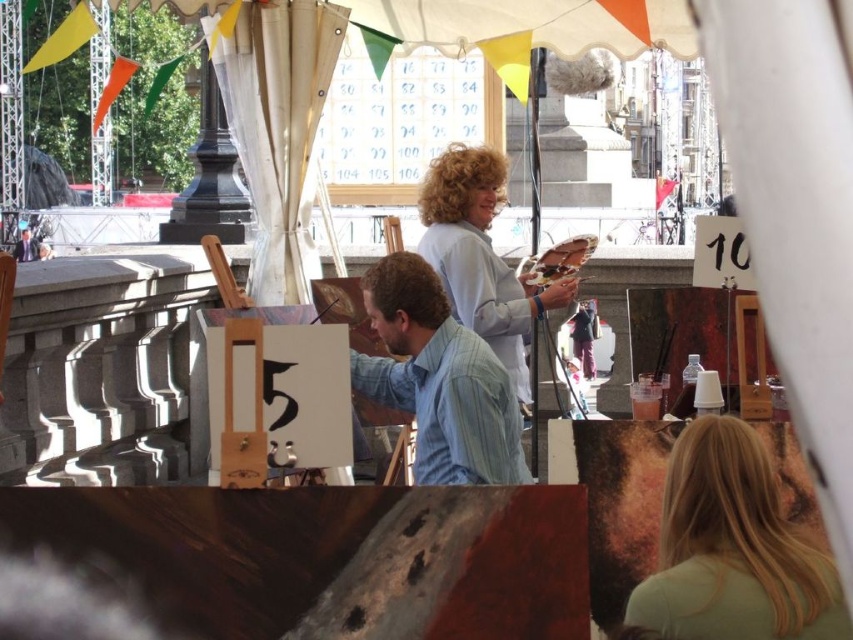
Which of these two, blonde hair at upper right or light blue fabric at center, stands taller?

With more height is light blue fabric at center.

At what (x,y) coordinates should I click in order to perform the action: click on blonde hair at upper right. Please return your answer as a coordinate pair (x, y). Looking at the image, I should click on (733, 548).

How far apart are blonde hair at upper right and light blue striped shirt at center?

blonde hair at upper right and light blue striped shirt at center are 13.16 meters apart from each other.

Who is more forward, [788,545] or [434,355]?

Positioned in front is point [788,545].

At what (x,y) coordinates should I click in order to perform the action: click on blonde hair at upper right. Please return your answer as a coordinate pair (x, y). The height and width of the screenshot is (640, 853). Looking at the image, I should click on (733, 548).

Which of these two, light blue striped shirt at center or light blue fabric at center, stands shorter?

With less height is light blue striped shirt at center.

Is light blue striped shirt at center positioned at the back of light blue fabric at center?

No, it is not.

Find the location of a particular element. light blue striped shirt at center is located at coordinates (438, 380).

Where is `light blue striped shirt at center`? Image resolution: width=853 pixels, height=640 pixels. light blue striped shirt at center is located at coordinates (438, 380).